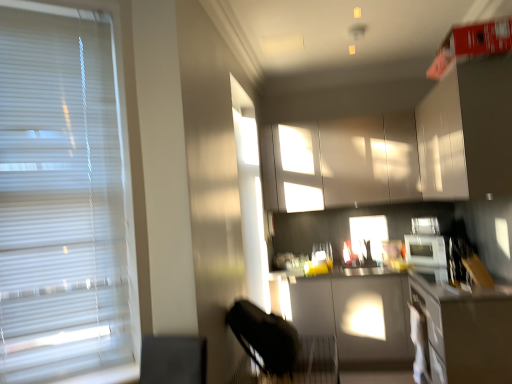
Image resolution: width=512 pixels, height=384 pixels. Describe the element at coordinates (465, 331) in the screenshot. I see `smooth gray countertop at lower right, arranged as the 1th counter top when ordered from the bottom` at that location.

This screenshot has height=384, width=512. What do you see at coordinates (425, 250) in the screenshot?
I see `white glossy microwave at right` at bounding box center [425, 250].

The height and width of the screenshot is (384, 512). Identify the location of black leather swivel chair at lower center. (283, 347).

What are the coordinates of `smooth gray countertop at lower right, arranged as the first counter top when viewed from the front` in the screenshot? It's located at (465, 331).

Is white blinds at left taller or shorter than matte gray countertop at center, arranged as the second counter top when ordered from the bottom?

In the image, white blinds at left appears to be taller than matte gray countertop at center, arranged as the second counter top when ordered from the bottom.

In terms of width, does white blinds at left look wider or thinner when compared to matte gray countertop at center, which appears as the second counter top when viewed from the front?

Considering their sizes, white blinds at left looks slimmer than matte gray countertop at center, which appears as the second counter top when viewed from the front.

Does point (118, 196) come in front of point (436, 268)?

Yes, point (118, 196) is in front of point (436, 268).

Is white glossy cabinet at upper right, which appears as the 2th cabinetry when viewed from the back, at the left side of matte gray countertop at center, arranged as the second counter top when ordered from the bottom?

Correct, you'll find white glossy cabinet at upper right, which appears as the 2th cabinetry when viewed from the back, to the left of matte gray countertop at center, arranged as the second counter top when ordered from the bottom.

Is white glossy cabinet at upper right, the 1th cabinetry positioned from the front, closer to the viewer compared to matte gray countertop at center, which ranks as the first counter top in back-to-front order?

Yes, the depth of white glossy cabinet at upper right, the 1th cabinetry positioned from the front, is less than that of matte gray countertop at center, which ranks as the first counter top in back-to-front order.

Are white glossy cabinet at upper right, which appears as the 2th cabinetry when viewed from the back, and matte gray countertop at center, which ranks as the first counter top in back-to-front order, beside each other?

No, white glossy cabinet at upper right, which appears as the 2th cabinetry when viewed from the back, is not next to matte gray countertop at center, which ranks as the first counter top in back-to-front order.

Who is shorter, white blinds at left or black leather swivel chair at lower center?

black leather swivel chair at lower center.

Can you confirm if white blinds at left is smaller than black leather swivel chair at lower center?

Yes, white blinds at left is smaller than black leather swivel chair at lower center.

Between white blinds at left and black leather swivel chair at lower center, which one appears on the left side from the viewer's perspective?

Positioned to the left is white blinds at left.

This screenshot has height=384, width=512. I want to click on window blind above the black leather swivel chair at lower center (from the image's perspective), so click(x=60, y=196).

Based on the photo, who is smaller, matte gray countertop at center, which ranks as the first counter top in back-to-front order, or white glossy cabinets at upper center, acting as the 1th cabinetry starting from the back?

matte gray countertop at center, which ranks as the first counter top in back-to-front order, is smaller.

Is white glossy cabinets at upper center, the second cabinetry in the front-to-back sequence, located within matte gray countertop at center, the 1th counter top viewed from the top?

No, matte gray countertop at center, the 1th counter top viewed from the top, does not contain white glossy cabinets at upper center, the second cabinetry in the front-to-back sequence.

Does matte gray countertop at center, arranged as the second counter top when ordered from the bottom, turn towards white glossy cabinets at upper center, the second cabinetry in the front-to-back sequence?

No, matte gray countertop at center, arranged as the second counter top when ordered from the bottom, does not turn towards white glossy cabinets at upper center, the second cabinetry in the front-to-back sequence.

Based on the photo, measure the distance between matte gray countertop at center, the 1th counter top viewed from the top, and white glossy cabinets at upper center, acting as the 1th cabinetry starting from the back.

matte gray countertop at center, the 1th counter top viewed from the top, is 1.38 meters away from white glossy cabinets at upper center, acting as the 1th cabinetry starting from the back.

In the scene shown: Looking at the image, does white glossy cabinet at upper right, the 1th cabinetry positioned from the front, seem bigger or smaller compared to black leather swivel chair at lower center?

Considering their sizes, white glossy cabinet at upper right, the 1th cabinetry positioned from the front, takes up more space than black leather swivel chair at lower center.

This screenshot has width=512, height=384. Identify the location of swivel chair below the white glossy cabinet at upper right, which appears as the 2th cabinetry when viewed from the back (from the image's perspective). (283, 347).

Is white glossy cabinet at upper right, which appears as the 2th cabinetry when viewed from the back, inside or outside of black leather swivel chair at lower center?

white glossy cabinet at upper right, which appears as the 2th cabinetry when viewed from the back, cannot be found inside black leather swivel chair at lower center.

Could you tell me if white glossy cabinet at upper right, the 1th cabinetry positioned from the front, is turned towards black leather swivel chair at lower center?

No, white glossy cabinet at upper right, the 1th cabinetry positioned from the front, is not oriented towards black leather swivel chair at lower center.

Considering their positions, is smooth gray countertop at lower right, arranged as the 1th counter top when ordered from the bottom, located in front of or behind white glossy cabinet at upper right, the 1th cabinetry positioned from the front?

smooth gray countertop at lower right, arranged as the 1th counter top when ordered from the bottom, is positioned closer to the viewer than white glossy cabinet at upper right, the 1th cabinetry positioned from the front.

Would you say smooth gray countertop at lower right, arranged as the 2th counter top when viewed from the back, contains white glossy cabinet at upper right, which appears as the 2th cabinetry when viewed from the back?

Actually, white glossy cabinet at upper right, which appears as the 2th cabinetry when viewed from the back, is outside smooth gray countertop at lower right, arranged as the 2th counter top when viewed from the back.

Who is taller, smooth gray countertop at lower right, arranged as the 2th counter top when viewed from the back, or white glossy cabinet at upper right, the 1th cabinetry positioned from the front?

A: white glossy cabinet at upper right, the 1th cabinetry positioned from the front.

Does point (469, 332) come closer to viewer compared to point (453, 96)?

Yes.

Does smooth gray countertop at lower right, arranged as the 2th counter top when viewed from the back, have a smaller size compared to black leather swivel chair at lower center?

Actually, smooth gray countertop at lower right, arranged as the 2th counter top when viewed from the back, might be larger than black leather swivel chair at lower center.

What are the coordinates of `swivel chair to the left of smooth gray countertop at lower right, arranged as the 1th counter top when ordered from the bottom` in the screenshot? It's located at (283, 347).

From the image's perspective, is smooth gray countertop at lower right, arranged as the first counter top when viewed from the front, under black leather swivel chair at lower center?

Actually, smooth gray countertop at lower right, arranged as the first counter top when viewed from the front, appears above black leather swivel chair at lower center in the image.

Is smooth gray countertop at lower right, arranged as the 2th counter top when viewed from the back, oriented away from black leather swivel chair at lower center?

No, black leather swivel chair at lower center is not at the back of smooth gray countertop at lower right, arranged as the 2th counter top when viewed from the back.

Identify the location of window blind above the matte gray countertop at center, arranged as the second counter top when ordered from the bottom (from the image's perspective). The height and width of the screenshot is (384, 512). (60, 196).

There is a white glossy cabinet at upper right, the 1th cabinetry positioned from the front. At what (x,y) coordinates should I click in order to perform the action: click on the 1st counter top below it (from the image's perspective). Please return your answer as a coordinate pair (x, y). The image size is (512, 384). Looking at the image, I should click on (451, 287).

Considering their positions, is white glossy cabinets at upper center, the second cabinetry in the front-to-back sequence, positioned closer to black leather swivel chair at lower center than white glossy microwave at right?

white glossy microwave at right.

In the scene shown: Based on their spatial positions, is white glossy microwave at right or black leather swivel chair at lower center further from white blinds at left?

white glossy microwave at right.

Based on the photo, considering their positions, is white blinds at left positioned further to black leather swivel chair at lower center than matte gray countertop at center, which ranks as the first counter top in back-to-front order?

white blinds at left is further to black leather swivel chair at lower center.

From the image, which object appears to be farther from white blinds at left, white glossy cabinet at upper right, the 1th cabinetry positioned from the front, or white glossy cabinets at upper center, the second cabinetry in the front-to-back sequence?

white glossy cabinets at upper center, the second cabinetry in the front-to-back sequence, is further to white blinds at left.

Considering their positions, is matte gray countertop at center, which ranks as the first counter top in back-to-front order, positioned closer to black leather swivel chair at lower center than white glossy microwave at right?

matte gray countertop at center, which ranks as the first counter top in back-to-front order, lies closer to black leather swivel chair at lower center than the other object.

Looking at this image, from the image, which object appears to be nearer to white glossy cabinet at upper right, which appears as the 2th cabinetry when viewed from the back, white blinds at left or black leather swivel chair at lower center?

Among the two, black leather swivel chair at lower center is located nearer to white glossy cabinet at upper right, which appears as the 2th cabinetry when viewed from the back.

Based on their spatial positions, is white glossy microwave at right or white glossy cabinets at upper center, the second cabinetry in the front-to-back sequence, closer to black leather swivel chair at lower center?

The object closer to black leather swivel chair at lower center is white glossy microwave at right.

Looking at the image, which one is located closer to white blinds at left, smooth gray countertop at lower right, arranged as the first counter top when viewed from the front, or black leather swivel chair at lower center?

black leather swivel chair at lower center.

Identify the location of cabinetry between white blinds at left and white glossy cabinet at upper right, the 1th cabinetry positioned from the front, from left to right. The image size is (512, 384). (342, 163).

Locate an element on the screen. Image resolution: width=512 pixels, height=384 pixels. swivel chair between white blinds at left and smooth gray countertop at lower right, which appears as the 2th counter top when viewed from the top is located at coordinates (283, 347).

Where is `appliance between white glossy cabinet at upper right, the 1th cabinetry positioned from the front, and smooth gray countertop at lower right, which appears as the 2th counter top when viewed from the top, vertically`? appliance between white glossy cabinet at upper right, the 1th cabinetry positioned from the front, and smooth gray countertop at lower right, which appears as the 2th counter top when viewed from the top, vertically is located at coordinates (425, 250).

The width and height of the screenshot is (512, 384). What are the coordinates of `swivel chair located between white blinds at left and white glossy cabinet at upper right, the 1th cabinetry positioned from the front, in the left-right direction` in the screenshot? It's located at (283, 347).